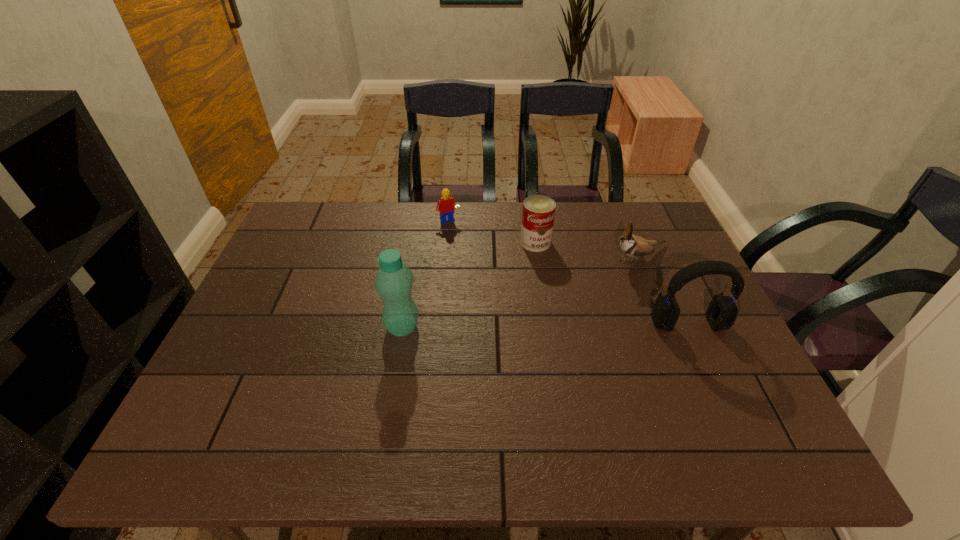
At what (x,y) coordinates should I click in order to perform the action: click on bottle. Please return your answer as a coordinate pair (x, y). This screenshot has width=960, height=540. Looking at the image, I should click on (394, 280).

Identify the location of headset. (722, 311).

You are a GUI agent. You are given a task and a screenshot of the screen. Output one action in this format:
    pyautogui.click(x=<x>, y=<y>)
    Task: Click on the bird
    
    Given the screenshot: What is the action you would take?
    [631, 245]

Image resolution: width=960 pixels, height=540 pixels. I want to click on the fourth tallest object, so 538,214.

Identify the location of the third object from left to right. (538, 214).

Find the location of `Lego`. Lego is located at coordinates tap(446, 204).

Locate an element on the screen. The height and width of the screenshot is (540, 960). the shortest object is located at coordinates (446, 204).

Find the location of a particular element. free spot located 0.390m on the right of the leftmost object is located at coordinates (570, 327).

Where is `free location located 0.070m on the headband of the headset`? The height and width of the screenshot is (540, 960). free location located 0.070m on the headband of the headset is located at coordinates (705, 360).

Image resolution: width=960 pixels, height=540 pixels. What are the coordinates of `vacant space situated at the face of the bird` in the screenshot? It's located at (591, 278).